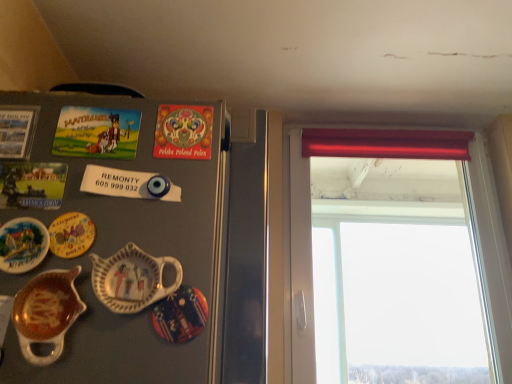
Question: Is smooth plastic window at right spatially inside matte ceramic plate at left, marked as the second plate in a left-to-right arrangement, or outside of it?

Choices:
 (A) inside
 (B) outside

Answer: (B)

Question: Is smooth plastic window at right taller or shorter than matte ceramic plate at left, acting as the 2th plate starting from the right?

Choices:
 (A) tall
 (B) short

Answer: (A)

Question: Which is farther from the red velvet curtain at upper center?

Choices:
 (A) smooth plastic window at right
 (B) decorative ceramic pitcher at left, marked as the second tableware in a left-to-right arrangement
 (C) matte ceramic plate at left, marked as the second plate in a left-to-right arrangement
 (D) multicolored ceramic plate at center, positioned as the third plate in left-to-right order
 (E) matte ceramic plate at left, acting as the third plate starting from the right

Answer: (E)

Question: Estimate the real-world distances between objects in this image. Which object is closer to the matte ceramic plate at left, acting as the 2th plate starting from the right?

Choices:
 (A) matte ceramic plate at left, acting as the third plate starting from the right
 (B) matte ceramic gravy boat at lower left, the second tableware when ordered from right to left
 (C) smooth plastic window at right
 (D) red velvet curtain at upper center
 (E) multicolored ceramic plate at center, the 1th plate when ordered from right to left

Answer: (A)